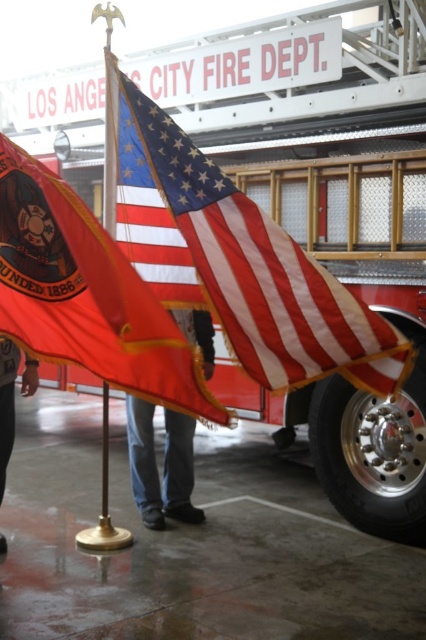
Who is lower down, american flag at center or matte red flag at center?

matte red flag at center

Find the location of a particular element. The width and height of the screenshot is (426, 640). american flag at center is located at coordinates (236, 260).

Is point (302, 314) positioned after point (213, 365)?

No, it is in front of (213, 365).

Describe the element at coordinates (236, 260) in the screenshot. I see `american flag at center` at that location.

Image resolution: width=426 pixels, height=640 pixels. Describe the element at coordinates (236, 260) in the screenshot. I see `american flag at center` at that location.

Locate an element on the screen. The width and height of the screenshot is (426, 640). american flag at center is located at coordinates (236, 260).

Who is more forward, [5,291] or [146,488]?

Point [5,291] is more forward.

What do you see at coordinates (86, 294) in the screenshot? I see `matte red flag at center` at bounding box center [86, 294].

Is point (58, 218) less distant than point (184, 472)?

Yes, it is.

The width and height of the screenshot is (426, 640). In order to click on matte red flag at center in this screenshot , I will do `click(86, 294)`.